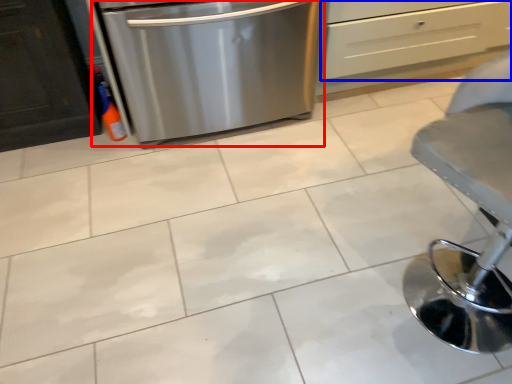
Question: Among these objects, which one is nearest to the camera, home appliance (highlighted by a red box) or drawer (highlighted by a blue box)?

Choices:
 (A) home appliance
 (B) drawer

Answer: (A)